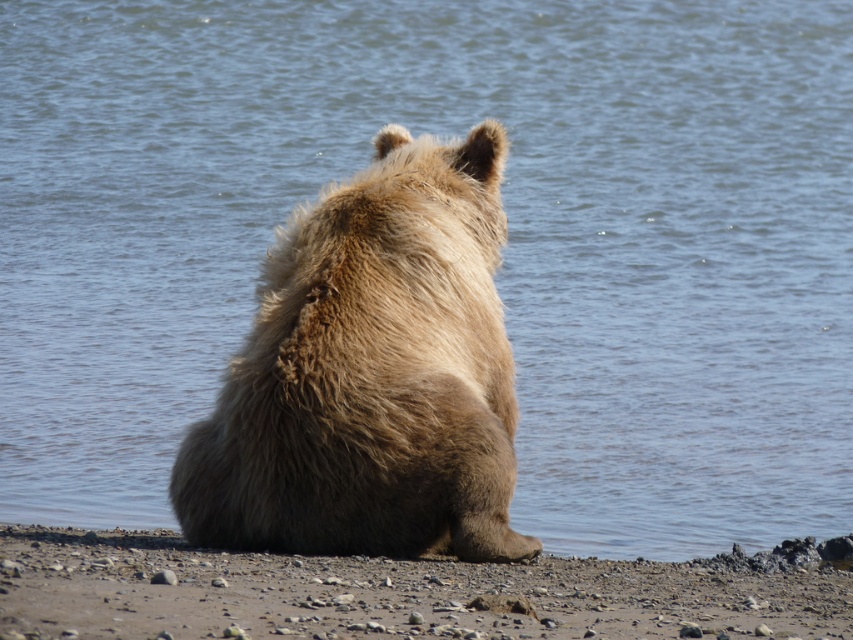
Question: Is fuzzy brown bear at center bigger than brown gravelly sand at lower center?

Choices:
 (A) no
 (B) yes

Answer: (B)

Question: Can you confirm if fuzzy brown bear at center is positioned above brown gravelly sand at lower center?

Choices:
 (A) no
 (B) yes

Answer: (B)

Question: Which point is closer to the camera?

Choices:
 (A) (39, 536)
 (B) (194, 452)

Answer: (B)

Question: Is fuzzy brown bear at center wider than brown gravelly sand at lower center?

Choices:
 (A) no
 (B) yes

Answer: (A)